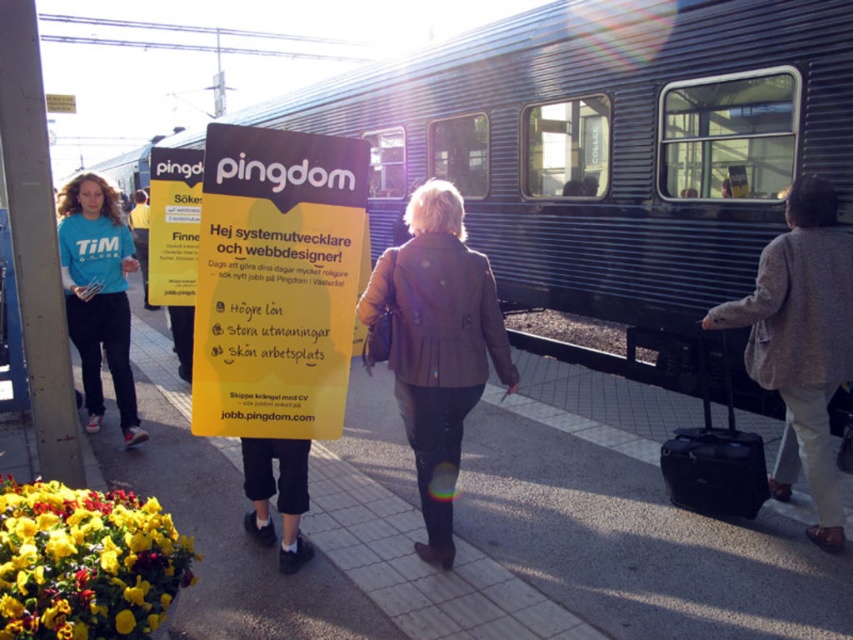
Measure the distance between point (430,284) and camera.

They are 3.23 meters apart.

Is point (404, 376) more distant than point (740, 476)?

No.

This screenshot has width=853, height=640. What do you see at coordinates (436, 346) in the screenshot? I see `brown leather jacket at center` at bounding box center [436, 346].

Find the location of a particular element. The width and height of the screenshot is (853, 640). brown leather jacket at center is located at coordinates (436, 346).

Between yellow paper sign at center and brown leather jacket at center, which one appears on the left side from the viewer's perspective?

yellow paper sign at center is more to the left.

Does point (340, 224) come behind point (410, 298)?

No, (340, 224) is in front of (410, 298).

Where is `yellow paper sign at center`? The width and height of the screenshot is (853, 640). yellow paper sign at center is located at coordinates (276, 282).

Does point (596, 116) come behind point (213, 180)?

Yes, point (596, 116) is behind point (213, 180).

Does metallic blue train at center have a lesser width compared to yellow paper sign at center?

In fact, metallic blue train at center might be wider than yellow paper sign at center.

The width and height of the screenshot is (853, 640). I want to click on metallic blue train at center, so click(x=608, y=152).

This screenshot has height=640, width=853. What are the coordinates of `metallic blue train at center` in the screenshot? It's located at (608, 152).